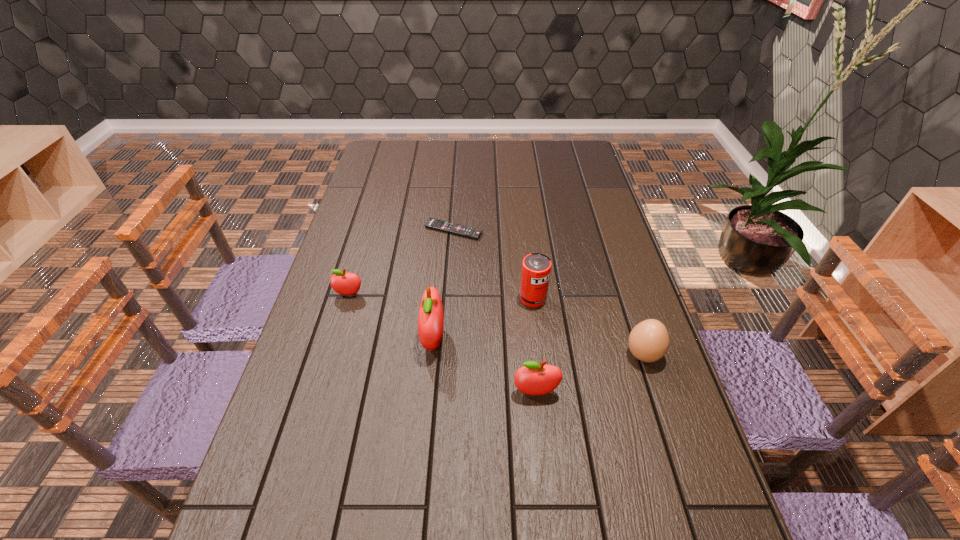
Find the location of a particular element. Image resolution: width=960 pixels, height=540 pixels. free location located on the right of the shortest apple is located at coordinates (396, 294).

You are a GUI agent. You are given a task and a screenshot of the screen. Output one action in this format:
    pyautogui.click(x=<x>, y=<y>)
    Task: Click on the vacant space located on the right of the second farthest apple
    
    Given the screenshot: What is the action you would take?
    pyautogui.click(x=584, y=339)

At what (x,y) coordinates should I click in order to perform the action: click on free space located 0.360m on the left of the second shortest apple. Please return your answer as a coordinate pair (x, y). Looking at the image, I should click on (359, 393).

The image size is (960, 540). I want to click on vacant area located 0.230m on the left of the can, so click(438, 299).

You are a GUI agent. You are given a task and a screenshot of the screen. Output one action in this format:
    pyautogui.click(x=<x>, y=<y>)
    Task: Click on the free region located on the back of the rightmost object
    
    Given the screenshot: What is the action you would take?
    pyautogui.click(x=609, y=250)

Locate an element on the screen. vacant space located 0.300m on the front of the shortest object is located at coordinates (448, 310).

Locate an element on the screen. object present at the left edge is located at coordinates (343, 283).

You are a GUI agent. You are given a task and a screenshot of the screen. Output one action in this format:
    pyautogui.click(x=<x>, y=<y>)
    Task: Click on the object that is at the right edge
    This screenshot has height=540, width=960.
    Given the screenshot: What is the action you would take?
    pyautogui.click(x=648, y=341)

You are a GUI agent. You are given a task and a screenshot of the screen. Output one action in this format:
    pyautogui.click(x=<x>, y=<y>)
    Task: Click on the free spot at the far edge of the desktop
    
    Given the screenshot: What is the action you would take?
    pyautogui.click(x=444, y=149)

Find the location of a particular element. The image size is (960, 540). vacant region at the near edge of the desktop is located at coordinates (516, 510).